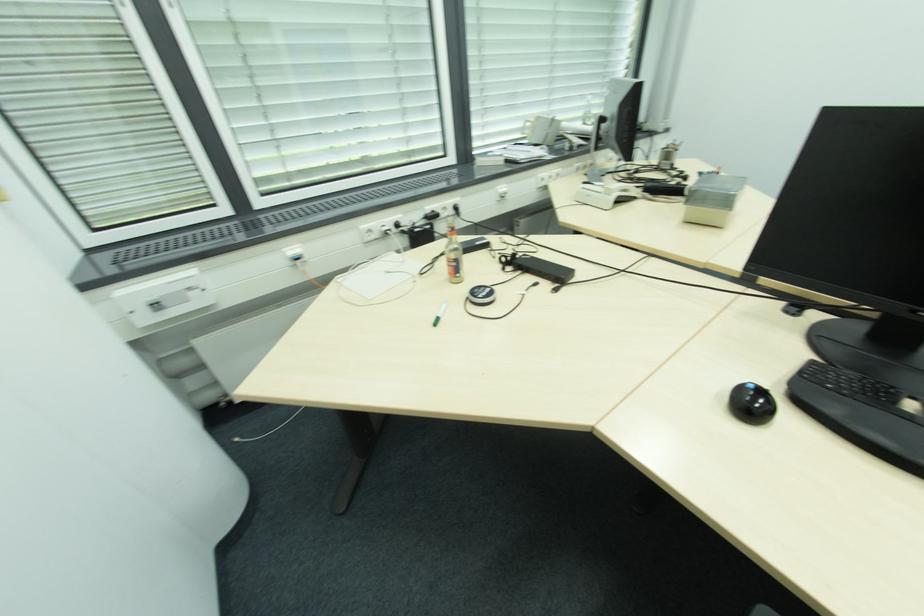
Identify the location of green and white marker. The height and width of the screenshot is (616, 924). (440, 314).